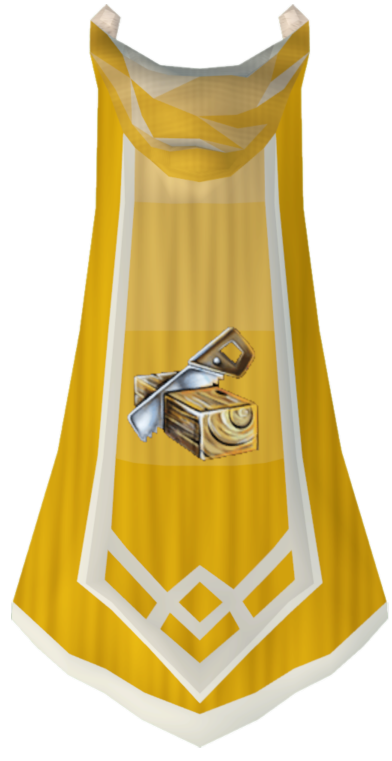
Image resolution: width=392 pixels, height=761 pixels. I want to click on tip of drape, so click(x=198, y=744).